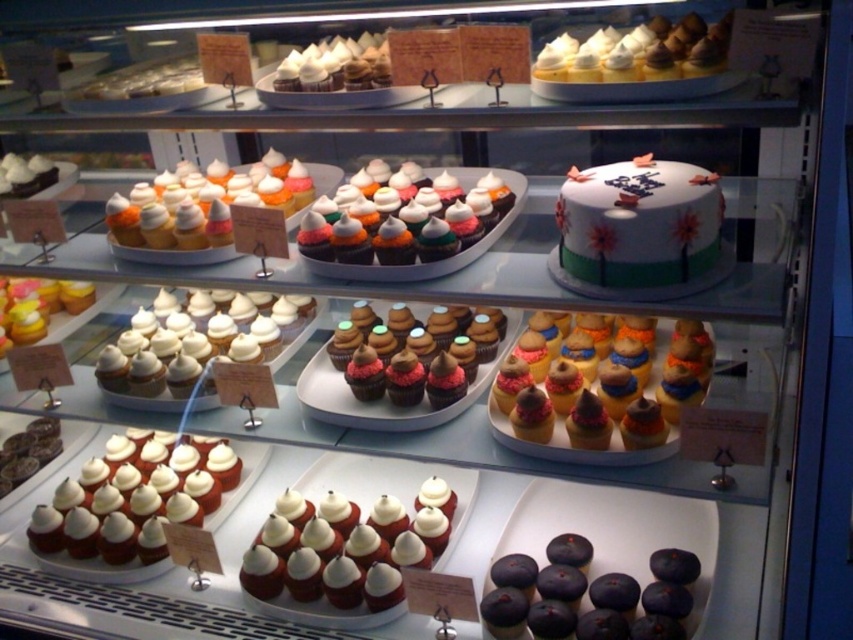
You are a customer looking at the display case. You want to buy the white fondant cake at upper right but also want to see the white glossy cupcake at upper center. Since the cake is blocking your view, where should you move to get a better look at the cupcake?

The white fondant cake at upper right is positioned under the white glossy cupcake at upper center, so moving to the left side of the display case would allow you to see around the cake and get a better view of the cupcake.

You are a baker trying to fit both the white glossy cupcake at center left and the matte white cupcake at left onto a tray that can only hold items up to 10 cm in width. Based on their widths, can both cupcakes fit side by side on the tray?

The white glossy cupcake at center left might be wider than matte white cupcake at left, so there is a possibility that together they exceed the 10 cm width limit. The baker should measure both cupcakes to confirm if they can fit side by side without exceeding the tray capacity.

You are a customer looking at the display case and want to choose a cupcake. You notice the white frosted cupcake at lower left and the dark purple cupcake at lower right. Which one is positioned higher up in the display case?

The white frosted cupcake at lower left is located above the dark purple cupcake at lower right, so it is positioned higher up in the display case.